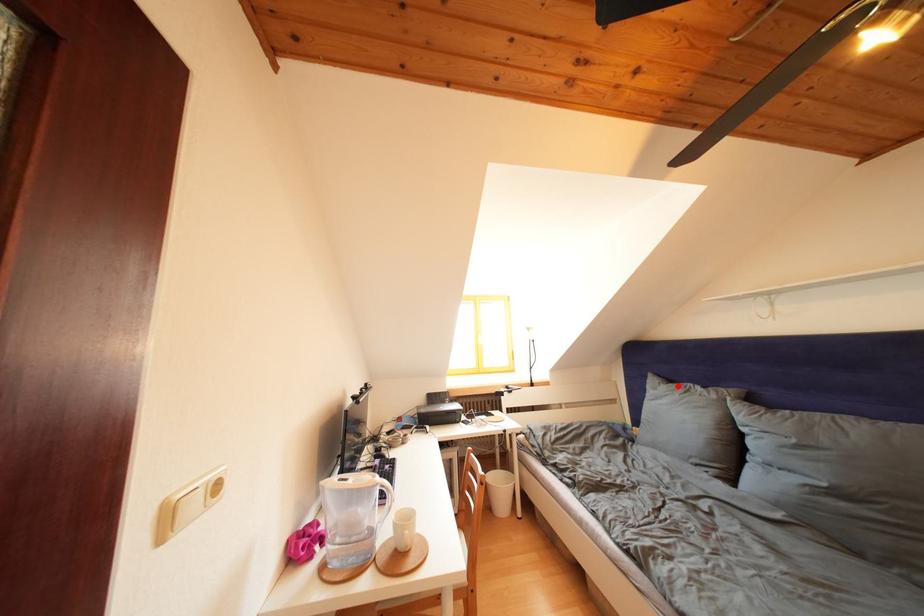
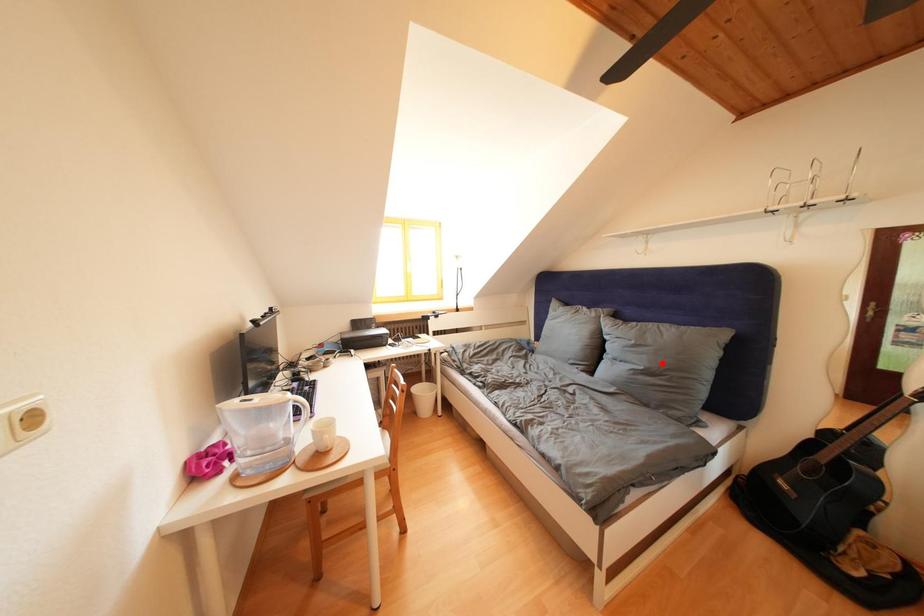
I am providing you with two images of the same scene from different viewpoints. A red point is marked on the first image and another point is marked on the second image. Do the highlighted points in image1 and image2 indicate the same real-world spot?

No